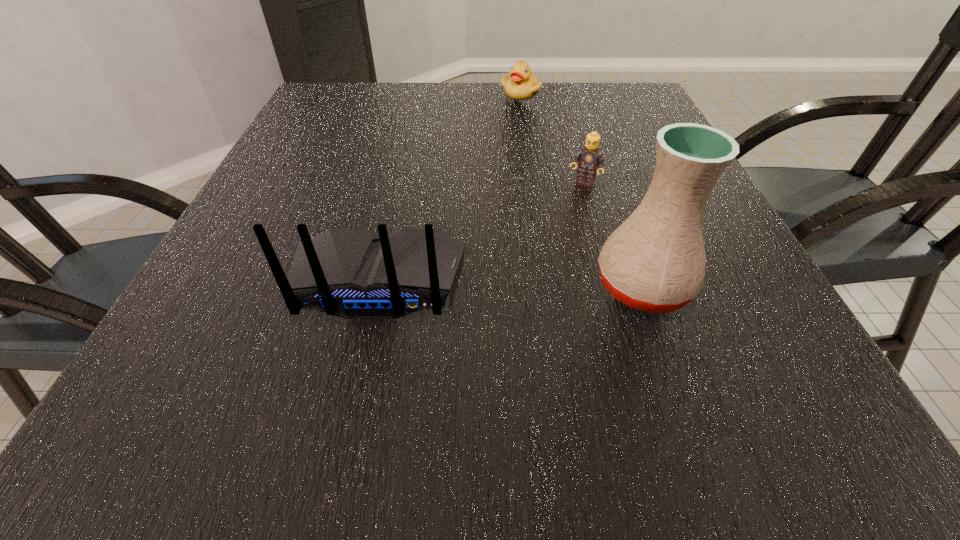
Locate an element on the screen. free space that is in between the third nearest object and the leftmost object is located at coordinates 482,232.

I want to click on free area in between the farthest object and the tallest object, so click(582, 189).

Find the location of `vacant space that is in between the second object from left to right and the leftmost object`. vacant space that is in between the second object from left to right and the leftmost object is located at coordinates (450, 187).

At what (x,y) coordinates should I click in order to perform the action: click on free spot between the pottery and the router. Please return your answer as a coordinate pair (x, y). This screenshot has width=960, height=540. Looking at the image, I should click on (511, 284).

The height and width of the screenshot is (540, 960). I want to click on free space that is in between the third nearest object and the third object from right to left, so click(x=552, y=138).

This screenshot has width=960, height=540. I want to click on free point between the duckling and the second tallest object, so click(450, 187).

Locate an element on the screen. Image resolution: width=960 pixels, height=540 pixels. free space between the tallest object and the farthest object is located at coordinates pyautogui.click(x=582, y=189).

The width and height of the screenshot is (960, 540). Identify the location of free space between the leftmost object and the pottery. (511, 284).

Identify which object is located as the third nearest to the third shortest object. Please provide its 2D coordinates. Your answer should be formatted as a tuple, i.e. [(x, y)], where the tuple contains the x and y coordinates of a point satisfying the conditions above.

[(522, 84)]

Identify the location of the third closest object to the second shortest object. (522, 84).